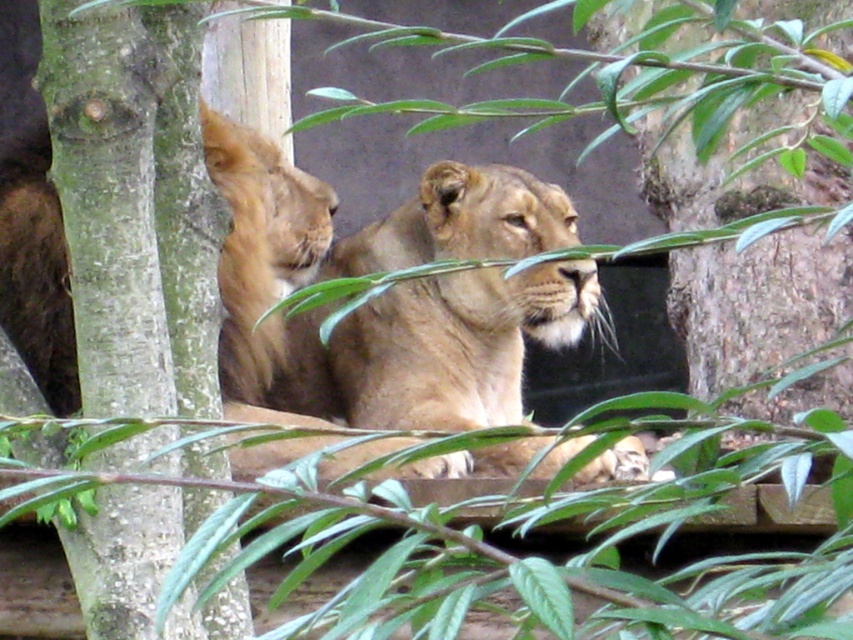
Question: Which point is farther to the camera?

Choices:
 (A) green rough bark at left
 (B) golden fur lion at center

Answer: (B)

Question: From the image, what is the correct spatial relationship of green rough bark at left in relation to golden fur lion at center?

Choices:
 (A) left
 (B) right

Answer: (A)

Question: Does green rough bark at left appear on the left side of golden fur lion at center?

Choices:
 (A) yes
 (B) no

Answer: (A)

Question: Does green rough bark at left appear on the left side of golden fur lion at center?

Choices:
 (A) no
 (B) yes

Answer: (B)